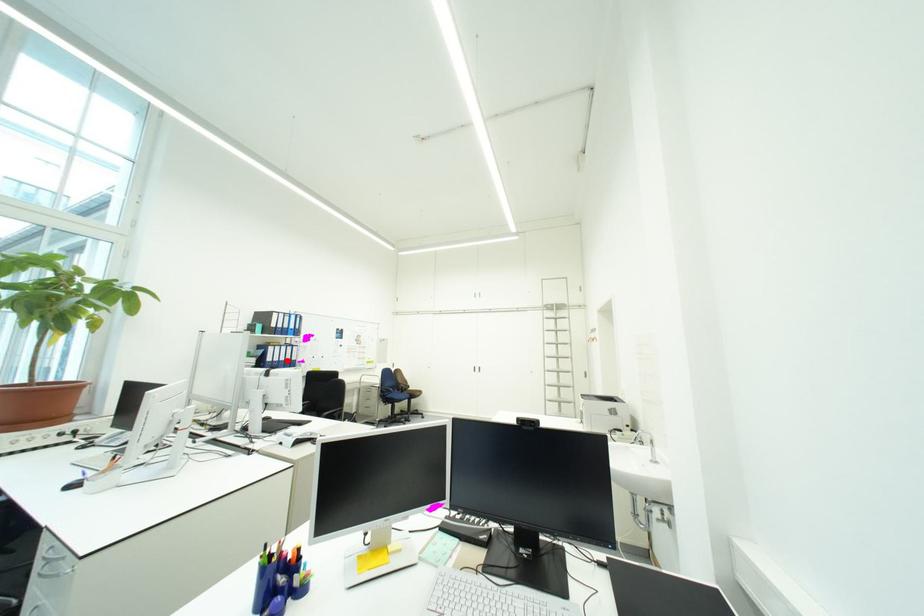
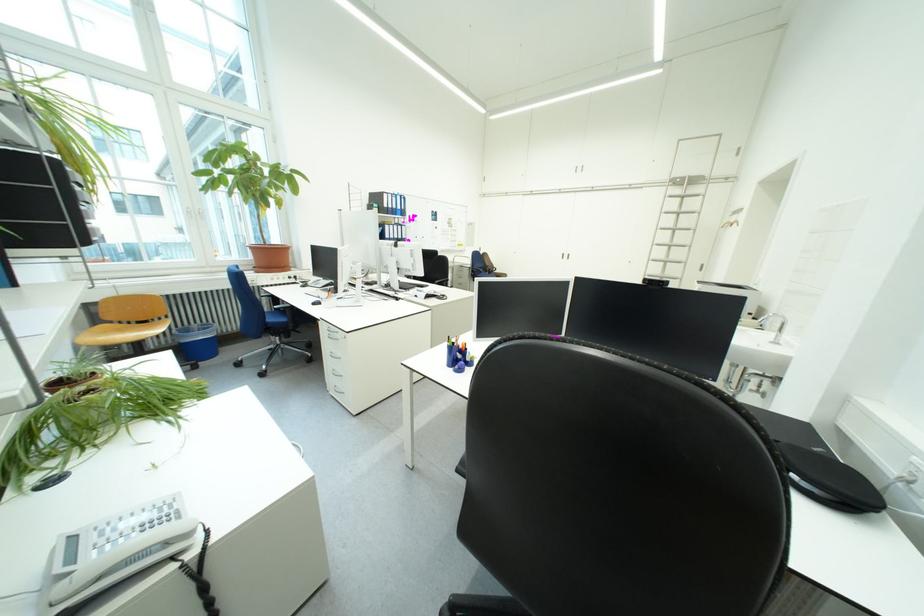
Question: I am providing you with two images of the same scene from different viewpoints. A red point is shown in image1. For the corresponding object point in image2, is it positioned nearer or farther from the camera?

Choices:
 (A) Nearer
 (B) Farther

Answer: (A)